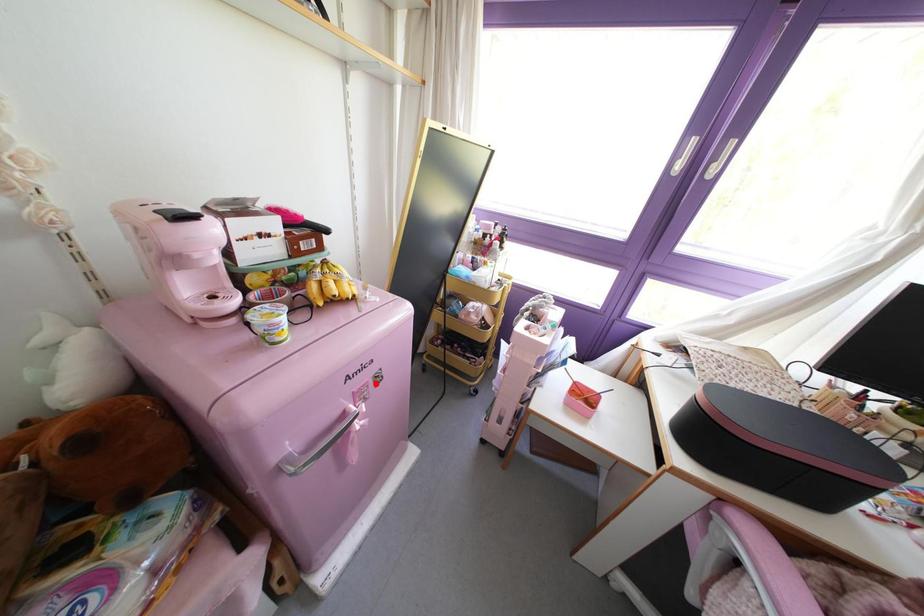
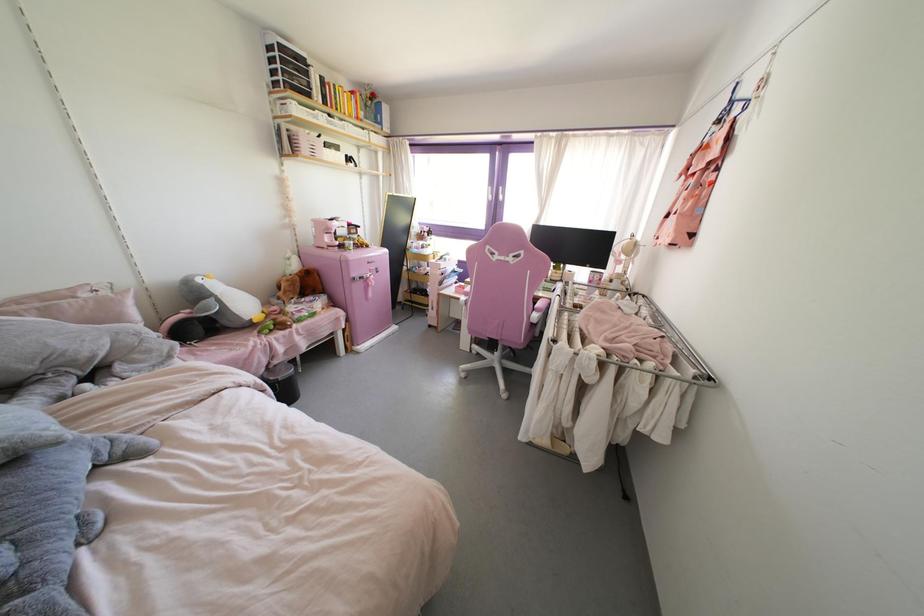
Question: I am providing you with two images of the same scene from different viewpoints. In image1, a red point is highlighted. Considering the same 3D point in image2, which of the following is correct?

Choices:
 (A) It is closer
 (B) It is farther

Answer: (A)